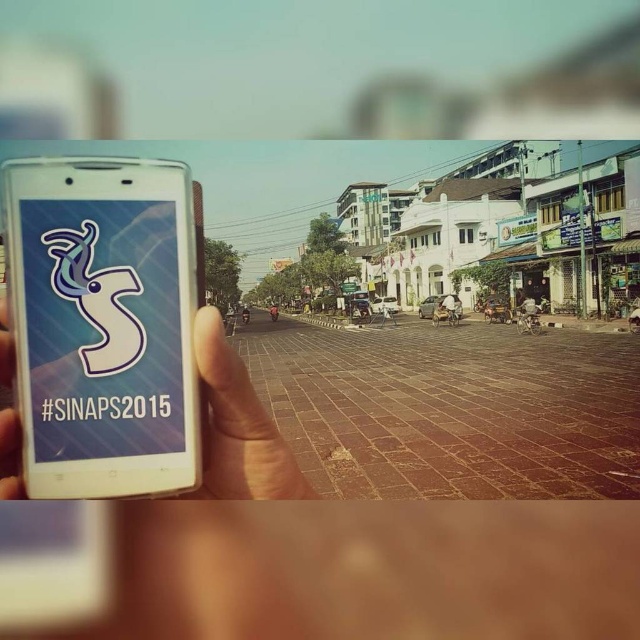
You are a delivery drone operator. Your drone needs to fly from the starting point at coordinates 0.5, 0.16 to deliver a package to the white glossy smartphone at left. Is the path clear for the drone to reach the smartphone without obstacles?

The white glossy smartphone at left is located at point (104,324), which is very close to the starting point (102,320). Since there are no other objects mentioned in the scene near this area, the path should be clear for the drone to reach the smartphone without obstacles.

Consider the image. You are a photographer standing in the street scene. You want to take a photo of the white glossy smartphone at left and the white matte phone at center. Which phone is positioned to the left of the other?

The white glossy smartphone at left is positioned to the left of the white matte phone at center.